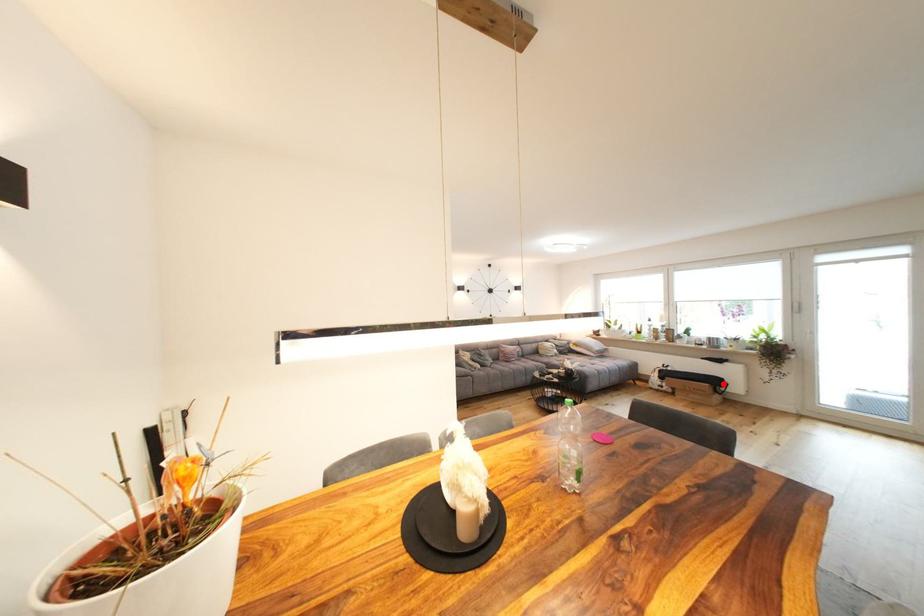
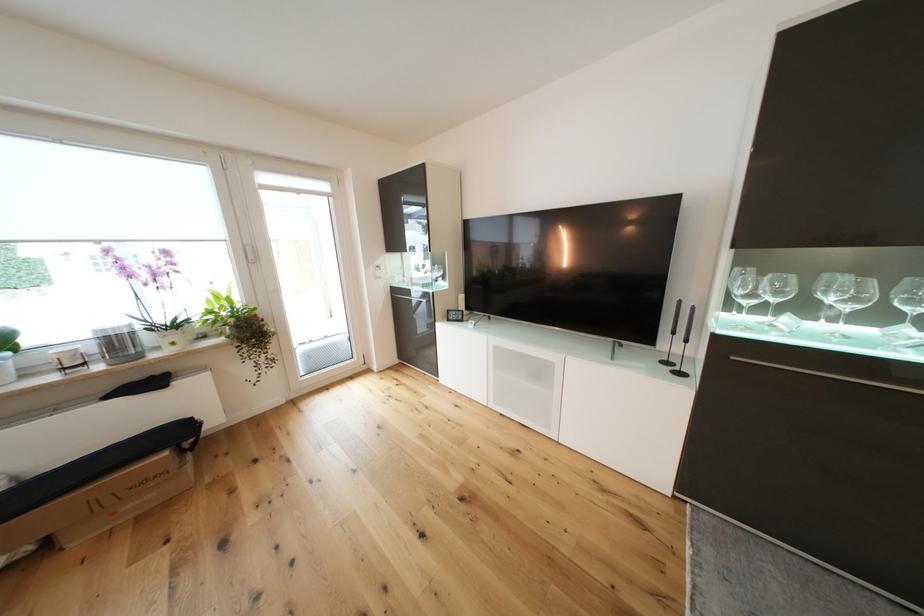
Locate, in the second image, the point that corresponds to the highlighted location in the first image.

(186, 435)